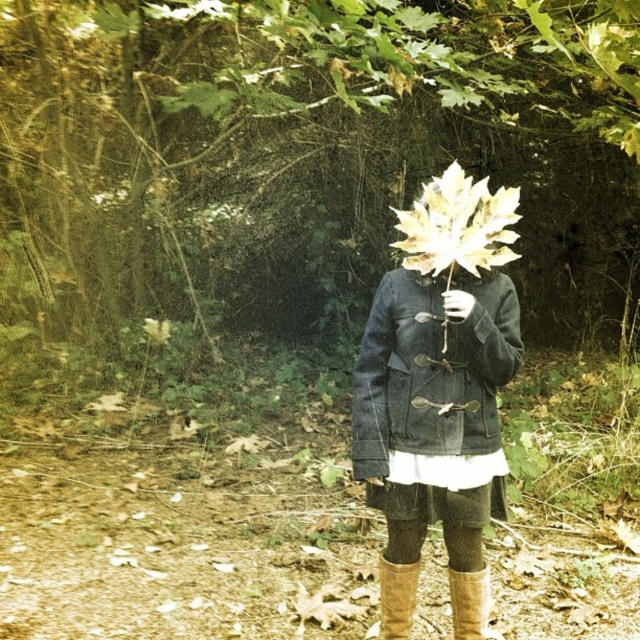
You are a photographer trying to capture the brown suede boot at lower center without the green leafy tree at center blocking the view. Can you move closer to the boot to ensure it is the main focus of the photo?

The green leafy tree at center is further to the viewer than the brown suede boot at lower center, so moving closer to the boot might bring it into focus while the tree could be positioned behind it, potentially reducing obstruction.

You are a photographer trying to capture a clear shot of the leather boots at lower center. However, the matte gray coat at center is blocking your view. Can you move the coat to the side to get an unobstructed view of the boots?

The matte gray coat at center is in front of the leather boots at lower center, so moving the coat to the side would allow an unobstructed view of the boots.